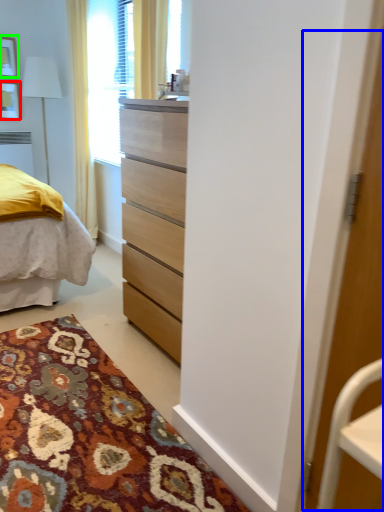
Question: Considering the real-world distances, which object is farthest from picture frame (highlighted by a red box)? screen door (highlighted by a blue box) or picture frame (highlighted by a green box)?

Choices:
 (A) screen door
 (B) picture frame

Answer: (A)